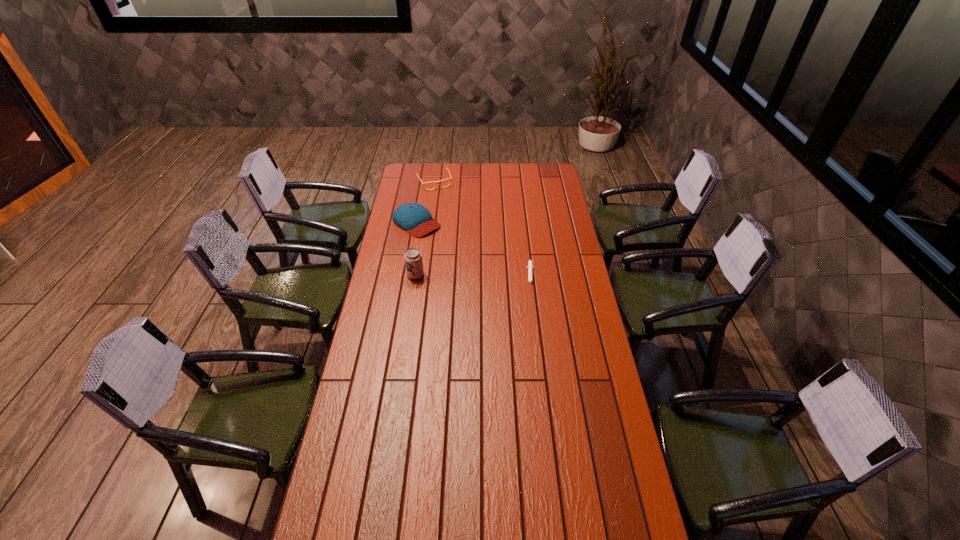
Image resolution: width=960 pixels, height=540 pixels. I want to click on free space on the desktop that is between the tallest object and the syringe and is positioned in front of the lenses of the farthest object, so (479, 276).

Locate an element on the screen. vacant space on the desktop that is between the beer can and the rightmost object and is positioned with the bill of the baseball cap facing forward is located at coordinates (486, 276).